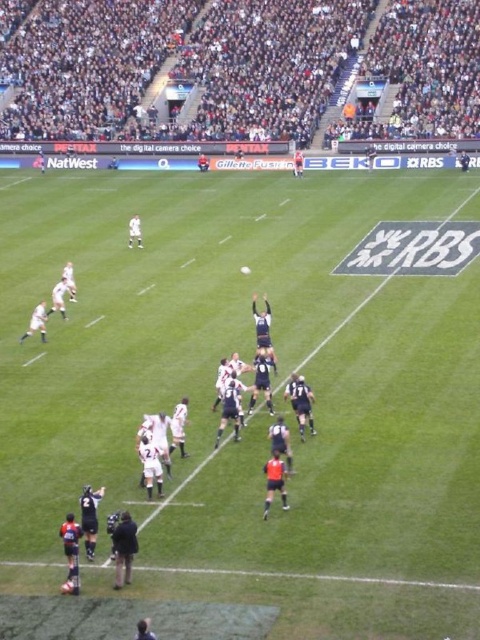
Does green grass field at center appear under black jersey at lower left?

Actually, green grass field at center is above black jersey at lower left.

I want to click on green grass field at center, so click(255, 410).

Describe the element at coordinates (241, 68) in the screenshot. Image resolution: width=480 pixels, height=640 pixels. I see `dark gray stadium seats at upper center` at that location.

Who is shorter, dark gray stadium seats at upper center or black matte referee at lower left?

black matte referee at lower left is shorter.

Where is `dark gray stadium seats at upper center`? This screenshot has width=480, height=640. dark gray stadium seats at upper center is located at coordinates (241, 68).

The image size is (480, 640). In order to click on dark gray stadium seats at upper center in this screenshot , I will do `click(241, 68)`.

Which of these two, dark gray stadium seats at upper center or black jersey at lower left, stands shorter?

Standing shorter between the two is black jersey at lower left.

How much distance is there between dark gray stadium seats at upper center and black jersey at lower left?

dark gray stadium seats at upper center and black jersey at lower left are 61.04 meters apart from each other.

Measure the distance between dark gray stadium seats at upper center and camera.

They are 61.79 meters apart.

At what (x,y) coordinates should I click in order to perform the action: click on dark gray stadium seats at upper center. Please return your answer as a coordinate pair (x, y). The width and height of the screenshot is (480, 640). Looking at the image, I should click on (241, 68).